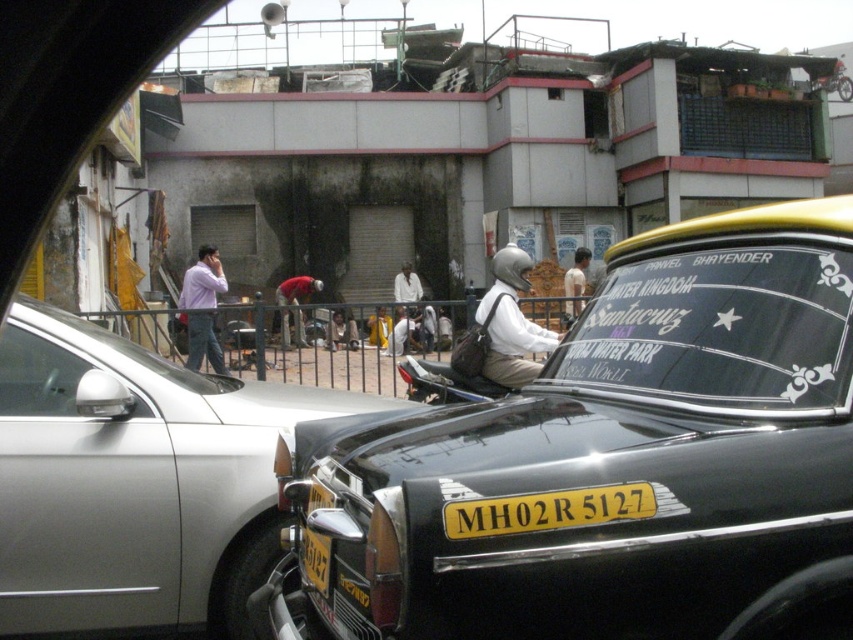
Is point (500, 358) farther from viewer compared to point (210, 266)?

No.

Does point (540, 365) come closer to viewer compared to point (212, 257)?

That is True.

This screenshot has width=853, height=640. I want to click on matte white helmet at center, so click(511, 323).

Which of these two, light brown leather jacket at center or white matte shirt at center, stands shorter?

Standing shorter between the two is light brown leather jacket at center.

Does point (332, 316) lie behind point (410, 278)?

No, it is in front of (410, 278).

The image size is (853, 640). Identify the location of light brown leather jacket at center. (341, 330).

Which is more to the right, yellow metallic license plate at center or light brown leather jacket at center?

yellow metallic license plate at center

Is the position of yellow metallic license plate at center less distant than that of light brown leather jacket at center?

Yes, yellow metallic license plate at center is in front of light brown leather jacket at center.

Measure the distance between yellow metallic license plate at center and camera.

yellow metallic license plate at center and camera are 9.17 feet apart.

You are a GUI agent. You are given a task and a screenshot of the screen. Output one action in this format:
    pyautogui.click(x=<x>, y=<y>)
    Task: Click on the yellow metallic license plate at center
    
    Given the screenshot: What is the action you would take?
    pyautogui.click(x=315, y=560)